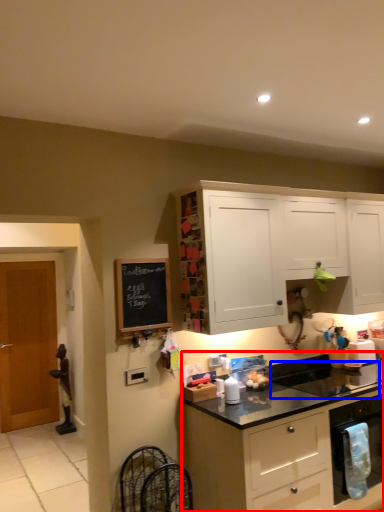
Question: Which object appears closest to the camera in this image, cabinetry (highlighted by a red box) or sink (highlighted by a blue box)?

Choices:
 (A) cabinetry
 (B) sink

Answer: (A)